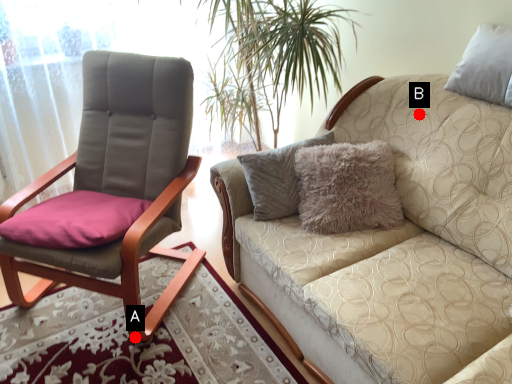
Question: Two points are circled on the image, labeled by A and B beside each circle. Which point is farther to the camera?

Choices:
 (A) A is further
 (B) B is further

Answer: (B)